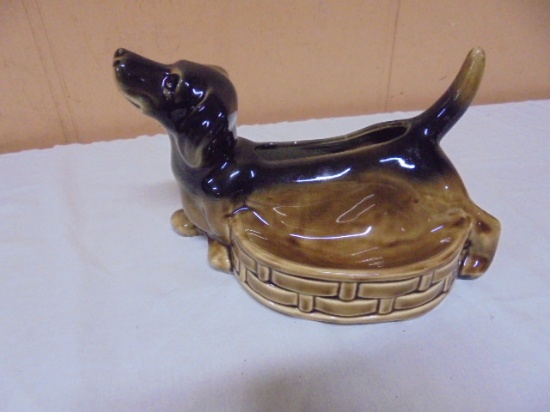
Find the location of a particular element. The image size is (550, 412). shadow on white table is located at coordinates (274, 400).